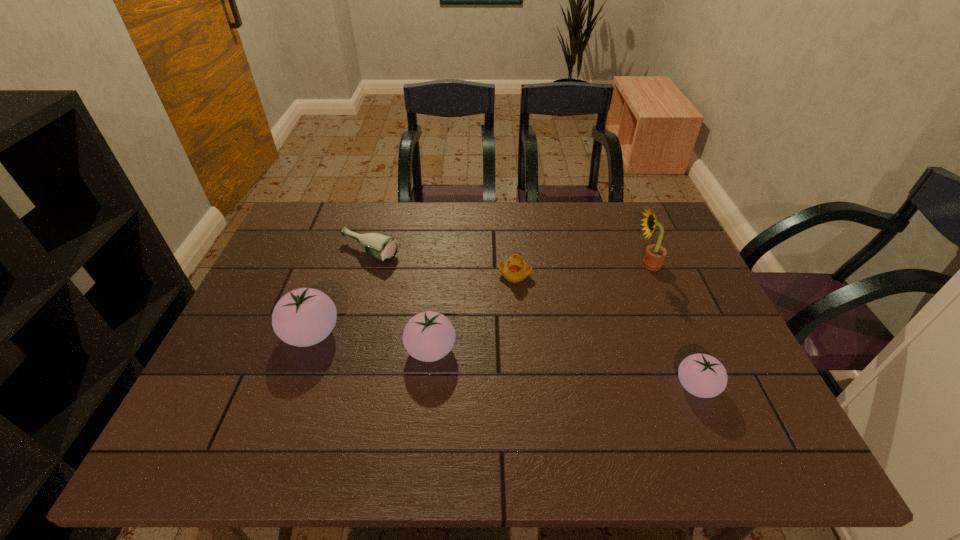
At what (x,y) coordinates should I click in order to perform the action: click on free point located 0.370m on the left of the second tomato from left to right. Please return your answer as a coordinate pair (x, y). Image resolution: width=960 pixels, height=540 pixels. Looking at the image, I should click on (254, 350).

At what (x,y) coordinates should I click in order to perform the action: click on free spot located 0.260m on the back of the rightmost tomato. Please return your answer as a coordinate pair (x, y). Looking at the image, I should click on (657, 291).

The image size is (960, 540). I want to click on vacant space located 0.170m on the face of the tallest object, so click(x=576, y=264).

The height and width of the screenshot is (540, 960). In order to click on vacant space located 0.200m on the face of the tallest object in this screenshot , I will do `click(566, 264)`.

Where is `free spot located on the face of the tallest object`? free spot located on the face of the tallest object is located at coordinates (536, 264).

The height and width of the screenshot is (540, 960). I want to click on free location located 0.050m on the front of the bottle, so click(x=362, y=279).

The width and height of the screenshot is (960, 540). Identify the location of vacant area situated 0.190m on the front-facing side of the fourth object from left to right. (520, 338).

The image size is (960, 540). Identify the location of object present at the far edge. (383, 247).

At what (x,y) coordinates should I click in order to perform the action: click on object at the near edge. Please return your answer as a coordinate pair (x, y). Looking at the image, I should click on (702, 375).

Identify the location of object located at the left edge. This screenshot has width=960, height=540. (303, 317).